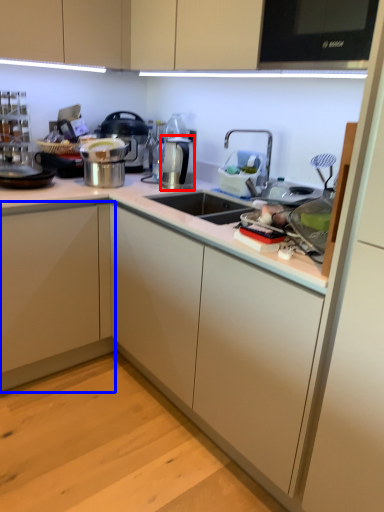
Question: Which object appears closest to the camera in this image, appliance (highlighted by a red box) or cabinetry (highlighted by a blue box)?

Choices:
 (A) appliance
 (B) cabinetry

Answer: (B)